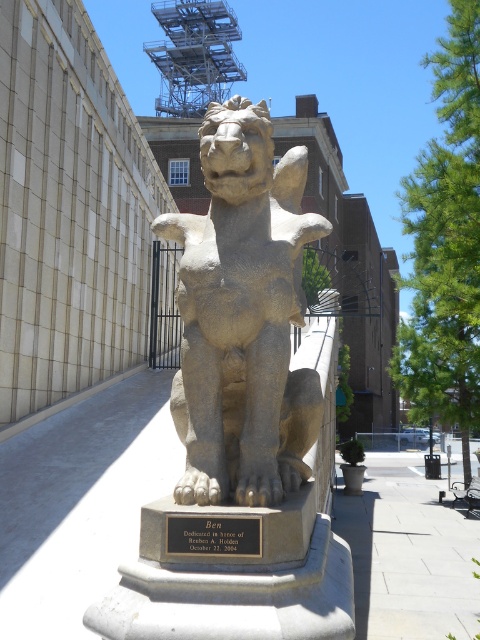
You are a tour guide standing 2 meters away from the camera position. You want to point out the stone lion at center to your visitors. Can you reach it without moving closer than your current position?

The stone lion at center is 2.30 meters away from the camera. Since you are 2 meters away from the camera, you can reach it without moving closer because the distance from your current position to the stone lion at center is 0.30 meters less than 2 meters.

You are standing on the paved walkway near the stone lion at center. If you face the direction where the plaque on the statue base is located, which direction should you turn to see the building with the grid roof?

The plaque is on the base of the stone lion at center, which is located at point [242,308]. Since the plaque is on the base facing forward, and the grid roof building is in the background behind the statue, you should face the plaque and turn towards the building with the grid roof, which is likely behind the statue. However, without specific directional data, the answer relies on typical statue orientations. Facing the plaque and turning towards the background would align with the building.